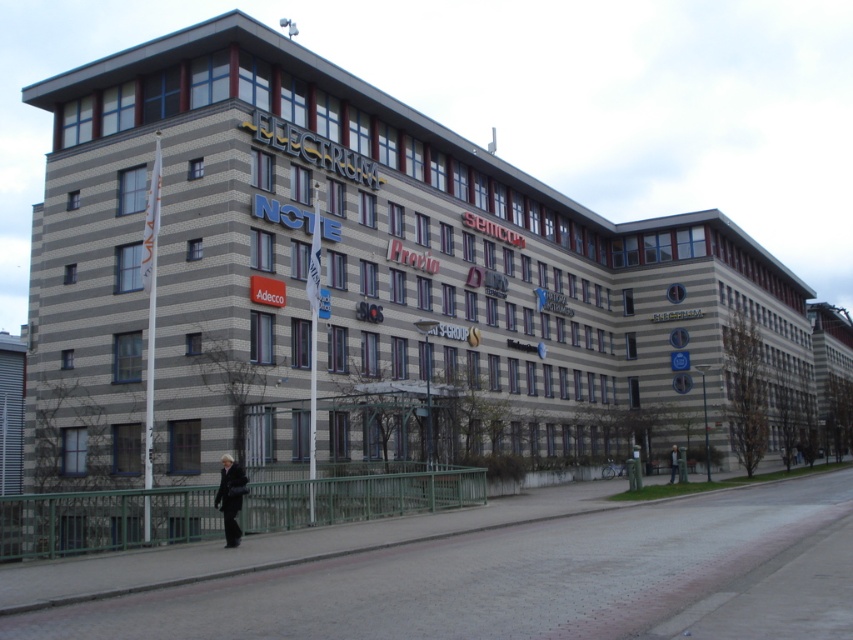
Question: Can you confirm if black leather coat at lower center is wider than black leather jacket at lower center?

Choices:
 (A) yes
 (B) no

Answer: (B)

Question: Which of the following is the closest to the observer?

Choices:
 (A) black leather coat at lower center
 (B) black leather jacket at lower center

Answer: (A)

Question: Is black leather coat at lower center to the left of black leather jacket at lower center from the viewer's perspective?

Choices:
 (A) no
 (B) yes

Answer: (B)

Question: Which point is farther from the camera taking this photo?

Choices:
 (A) (676, 445)
 (B) (241, 488)

Answer: (A)

Question: Does black leather coat at lower center have a larger size compared to black leather jacket at lower center?

Choices:
 (A) no
 (B) yes

Answer: (A)

Question: Which of the following is the closest to the observer?

Choices:
 (A) black leather coat at lower center
 (B) black leather jacket at lower center

Answer: (A)